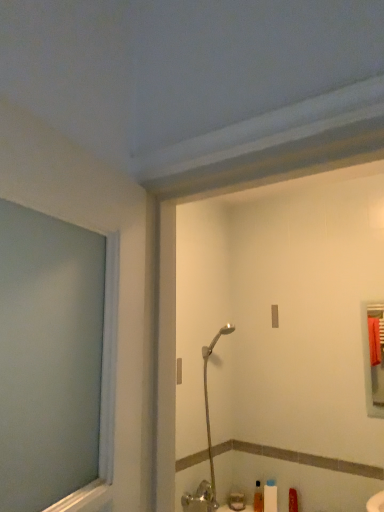
Question: Is translucent plastic soap dispenser at lower center next to silver metallic shower head at center and touching it?

Choices:
 (A) no
 (B) yes

Answer: (A)

Question: Considering the relative sizes of translucent plastic soap dispenser at lower center and silver metallic shower head at center in the image provided, is translucent plastic soap dispenser at lower center wider than silver metallic shower head at center?

Choices:
 (A) no
 (B) yes

Answer: (A)

Question: Does translucent plastic soap dispenser at lower center have a greater height compared to silver metallic shower head at center?

Choices:
 (A) no
 (B) yes

Answer: (A)

Question: From a real-world perspective, is translucent plastic soap dispenser at lower center located beneath silver metallic shower head at center?

Choices:
 (A) yes
 (B) no

Answer: (A)

Question: Can you confirm if translucent plastic soap dispenser at lower center is thinner than silver metallic shower head at center?

Choices:
 (A) no
 (B) yes

Answer: (B)

Question: Considering their positions, is silver metallic shower head at center located in front of or behind white matte toilet paper at lower center?

Choices:
 (A) behind
 (B) front

Answer: (B)

Question: From a real-world perspective, is silver metallic shower head at center above or below white matte toilet paper at lower center?

Choices:
 (A) above
 (B) below

Answer: (A)

Question: Is point (203, 374) closer or farther from the camera than point (273, 508)?

Choices:
 (A) closer
 (B) farther

Answer: (B)

Question: Considering the positions of silver metallic shower head at center and white matte toilet paper at lower center in the image, is silver metallic shower head at center bigger or smaller than white matte toilet paper at lower center?

Choices:
 (A) small
 (B) big

Answer: (B)

Question: In the image, is white matte toilet paper at lower center positioned in front of or behind translucent plastic soap dispenser at lower center?

Choices:
 (A) front
 (B) behind

Answer: (A)

Question: From a real-world perspective, is white matte toilet paper at lower center physically located above or below translucent plastic soap dispenser at lower center?

Choices:
 (A) above
 (B) below

Answer: (A)

Question: Is point (269, 498) closer or farther from the camera than point (259, 499)?

Choices:
 (A) farther
 (B) closer

Answer: (B)

Question: Considering the positions of white matte toilet paper at lower center and translucent plastic soap dispenser at lower center in the image, is white matte toilet paper at lower center wider or thinner than translucent plastic soap dispenser at lower center?

Choices:
 (A) wide
 (B) thin

Answer: (A)

Question: From a real-world perspective, is translucent plastic soap dispenser at lower center physically located above or below silver metallic shower head at center?

Choices:
 (A) below
 (B) above

Answer: (A)

Question: Considering the positions of translucent plastic soap dispenser at lower center and silver metallic shower head at center in the image, is translucent plastic soap dispenser at lower center taller or shorter than silver metallic shower head at center?

Choices:
 (A) tall
 (B) short

Answer: (B)